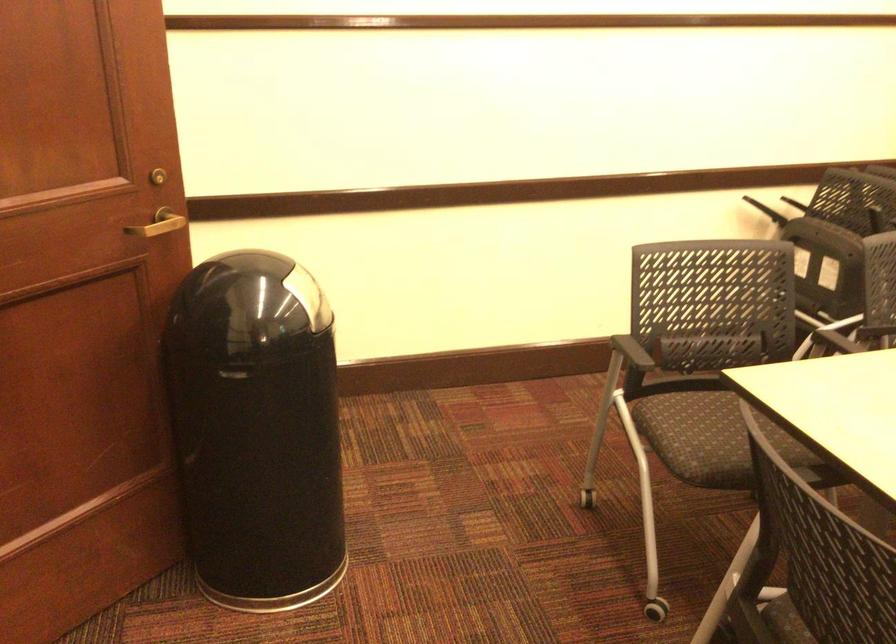
Describe the element at coordinates (720, 420) in the screenshot. I see `the chair sitting surface` at that location.